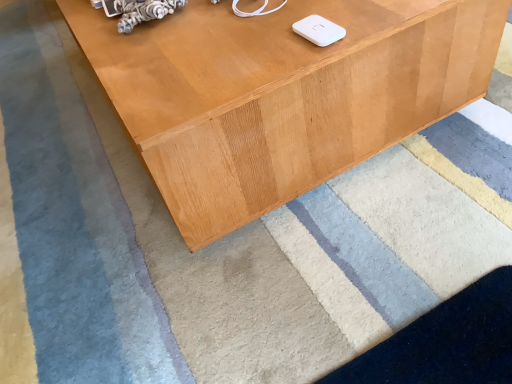
Question: From a real-world perspective, is light brown wood table at center physically above white matte ipod at upper center?

Choices:
 (A) no
 (B) yes

Answer: (A)

Question: Considering the relative sizes of light brown wood table at center and white matte ipod at upper center in the image provided, is light brown wood table at center wider than white matte ipod at upper center?

Choices:
 (A) no
 (B) yes

Answer: (B)

Question: Is light brown wood table at center next to white matte ipod at upper center and touching it?

Choices:
 (A) yes
 (B) no

Answer: (B)

Question: From the image's perspective, would you say light brown wood table at center is positioned over white matte ipod at upper center?

Choices:
 (A) no
 (B) yes

Answer: (B)

Question: Considering the relative sizes of light brown wood table at center and white matte ipod at upper center in the image provided, is light brown wood table at center taller than white matte ipod at upper center?

Choices:
 (A) no
 (B) yes

Answer: (B)

Question: Does light brown wood table at center have a larger size compared to white matte ipod at upper center?

Choices:
 (A) no
 (B) yes

Answer: (B)

Question: From the image's perspective, is white matte ipod at upper center on light brown wood table at center?

Choices:
 (A) yes
 (B) no

Answer: (B)

Question: Is white matte ipod at upper center facing away from light brown wood table at center?

Choices:
 (A) yes
 (B) no

Answer: (B)

Question: Considering the relative sizes of white matte ipod at upper center and light brown wood table at center in the image provided, is white matte ipod at upper center smaller than light brown wood table at center?

Choices:
 (A) yes
 (B) no

Answer: (A)

Question: Does white matte ipod at upper center have a larger size compared to light brown wood table at center?

Choices:
 (A) no
 (B) yes

Answer: (A)

Question: Is light brown wood table at center surrounded by white matte ipod at upper center?

Choices:
 (A) no
 (B) yes

Answer: (A)

Question: From a real-world perspective, is white matte ipod at upper center located higher than light brown wood table at center?

Choices:
 (A) no
 (B) yes

Answer: (B)

Question: In terms of width, does light brown wood table at center look wider or thinner when compared to white matte ipod at upper center?

Choices:
 (A) thin
 (B) wide

Answer: (B)